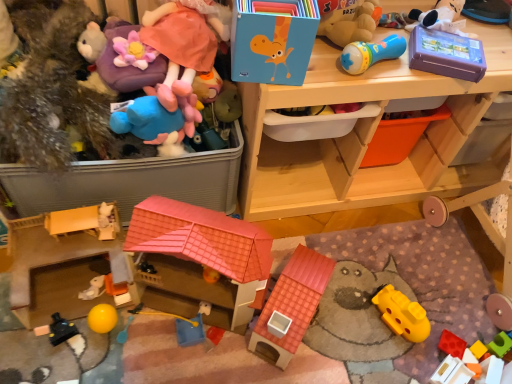
Question: Is there a large distance between rubberized red block at lower right, the thirteenth toy viewed from the left, and matte plastic toy at center, placed as the tenth toy when sorted from left to right?

Choices:
 (A) yes
 (B) no

Answer: (B)

Question: Does rubberized red block at lower right, the thirteenth toy viewed from the left, contain matte plastic toy at center, placed as the tenth toy when sorted from left to right?

Choices:
 (A) yes
 (B) no

Answer: (B)

Question: Is rubberized red block at lower right, the thirteenth toy viewed from the left, at the right side of matte plastic toy at center, placed as the tenth toy when sorted from left to right?

Choices:
 (A) no
 (B) yes

Answer: (B)

Question: Is the surface of rubberized red block at lower right, which appears as the 2th toy when viewed from the right, in direct contact with matte plastic toy at center, placed as the tenth toy when sorted from left to right?

Choices:
 (A) yes
 (B) no

Answer: (B)

Question: From a real-world perspective, is rubberized red block at lower right, which appears as the 2th toy when viewed from the right, over matte plastic toy at center, which is the 5th toy in right-to-left order?

Choices:
 (A) yes
 (B) no

Answer: (B)

Question: Based on their positions, is black plastic toy at lower left, the 13th toy viewed from the right, located to the left or right of matte plastic toy at center, placed as the tenth toy when sorted from left to right?

Choices:
 (A) left
 (B) right

Answer: (A)

Question: Relative to matte plastic toy at center, which is the 5th toy in right-to-left order, is black plastic toy at lower left, positioned as the 2th toy in left-to-right order, in front or behind?

Choices:
 (A) front
 (B) behind

Answer: (A)

Question: Looking at the image, does black plastic toy at lower left, positioned as the 2th toy in left-to-right order, seem bigger or smaller compared to matte plastic toy at center, placed as the tenth toy when sorted from left to right?

Choices:
 (A) big
 (B) small

Answer: (B)

Question: Considering the positions of black plastic toy at lower left, positioned as the 2th toy in left-to-right order, and matte plastic toy at center, placed as the tenth toy when sorted from left to right, in the image, is black plastic toy at lower left, positioned as the 2th toy in left-to-right order, taller or shorter than matte plastic toy at center, placed as the tenth toy when sorted from left to right,?

Choices:
 (A) tall
 (B) short

Answer: (B)

Question: Do you think purple plush toy at upper left, which is the ninth toy in right-to-left order, is within rubberized plastic blocks at lower right, placed as the fourteenth toy when sorted from left to right, or outside of it?

Choices:
 (A) outside
 (B) inside

Answer: (A)

Question: Considering the positions of point (108, 48) and point (478, 339), is point (108, 48) closer or farther from the camera than point (478, 339)?

Choices:
 (A) farther
 (B) closer

Answer: (B)

Question: From a real-world perspective, is purple plush toy at upper left, which appears as the 6th toy when viewed from the left, physically located above or below rubberized plastic blocks at lower right, positioned as the first toy in right-to-left order?

Choices:
 (A) below
 (B) above

Answer: (B)

Question: Considering the relative positions of purple plush toy at upper left, which appears as the 6th toy when viewed from the left, and rubberized plastic blocks at lower right, placed as the fourteenth toy when sorted from left to right, in the image provided, is purple plush toy at upper left, which appears as the 6th toy when viewed from the left, to the left or to the right of rubberized plastic blocks at lower right, placed as the fourteenth toy when sorted from left to right,?

Choices:
 (A) left
 (B) right

Answer: (A)

Question: Is white plush toy at lower left, the third toy positioned from the left, bigger or smaller than rubberized plastic microphone at upper right, arranged as the fourth toy when viewed from the right?

Choices:
 (A) small
 (B) big

Answer: (A)

Question: Considering their positions, is white plush toy at lower left, the third toy positioned from the left, located in front of or behind rubberized plastic microphone at upper right, arranged as the fourth toy when viewed from the right?

Choices:
 (A) behind
 (B) front

Answer: (A)